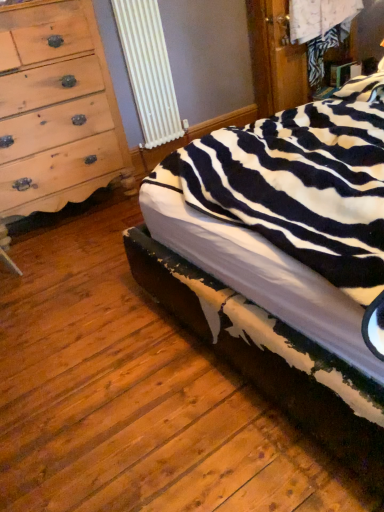
Question: Is light brown wood chest of drawers at left bigger than zebra-patterned fabric bed at center?

Choices:
 (A) no
 (B) yes

Answer: (A)

Question: Does light brown wood chest of drawers at left lie in front of zebra-patterned fabric bed at center?

Choices:
 (A) no
 (B) yes

Answer: (A)

Question: Is light brown wood chest of drawers at left further to camera compared to zebra-patterned fabric bed at center?

Choices:
 (A) yes
 (B) no

Answer: (A)

Question: Is light brown wood chest of drawers at left thinner than zebra-patterned fabric bed at center?

Choices:
 (A) no
 (B) yes

Answer: (B)

Question: Is light brown wood chest of drawers at left touching zebra-patterned fabric bed at center?

Choices:
 (A) no
 (B) yes

Answer: (A)

Question: Considering the relative positions of light brown wood chest of drawers at left and zebra-patterned fabric bed at center in the image provided, is light brown wood chest of drawers at left to the left of zebra-patterned fabric bed at center from the viewer's perspective?

Choices:
 (A) yes
 (B) no

Answer: (A)

Question: Is zebra-patterned fabric bed at center oriented away from light brown wood chest of drawers at left?

Choices:
 (A) no
 (B) yes

Answer: (A)

Question: Would you consider zebra-patterned fabric bed at center to be distant from light brown wood chest of drawers at left?

Choices:
 (A) yes
 (B) no

Answer: (A)

Question: From the image's perspective, is zebra-patterned fabric bed at center under light brown wood chest of drawers at left?

Choices:
 (A) no
 (B) yes

Answer: (B)

Question: From the image's perspective, would you say zebra-patterned fabric bed at center is positioned over light brown wood chest of drawers at left?

Choices:
 (A) yes
 (B) no

Answer: (B)

Question: Does zebra-patterned fabric bed at center turn towards light brown wood chest of drawers at left?

Choices:
 (A) no
 (B) yes

Answer: (A)

Question: Considering the relative sizes of zebra-patterned fabric bed at center and light brown wood chest of drawers at left in the image provided, is zebra-patterned fabric bed at center shorter than light brown wood chest of drawers at left?

Choices:
 (A) yes
 (B) no

Answer: (A)

Question: From their relative heights in the image, would you say zebra-patterned fabric bed at center is taller or shorter than light brown wood chest of drawers at left?

Choices:
 (A) tall
 (B) short

Answer: (B)